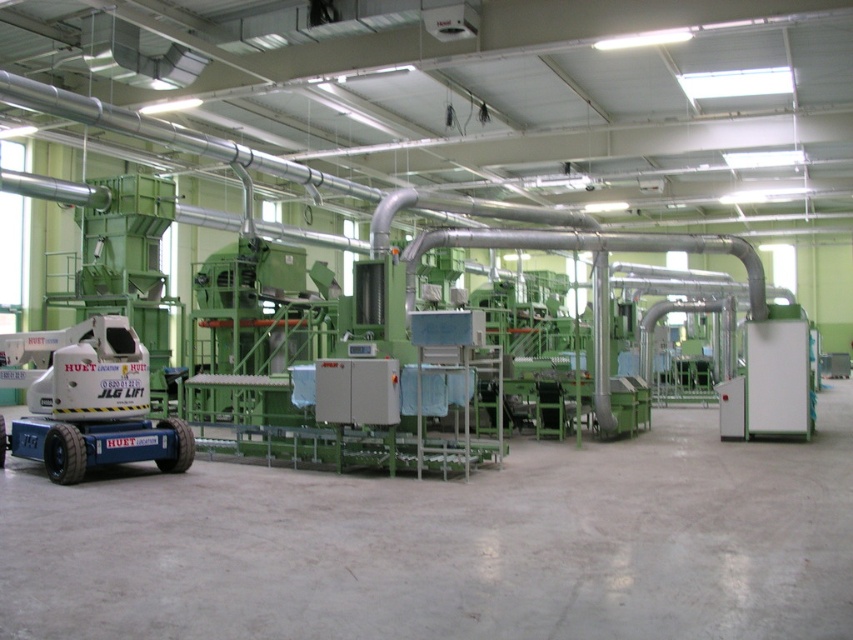
Question: Does white plastic lift at left lie in front of metallic silver pipe at center?

Choices:
 (A) no
 (B) yes

Answer: (B)

Question: Is white plastic lift at left positioned in front of metallic silver pipe at center?

Choices:
 (A) yes
 (B) no

Answer: (A)

Question: Which object is farther from the camera taking this photo?

Choices:
 (A) white plastic lift at left
 (B) metallic silver pipe at center

Answer: (B)

Question: Which point is closer to the camera taking this photo?

Choices:
 (A) (659, 243)
 (B) (109, 330)

Answer: (B)

Question: Does white plastic lift at left appear on the left side of metallic silver pipe at center?

Choices:
 (A) yes
 (B) no

Answer: (A)